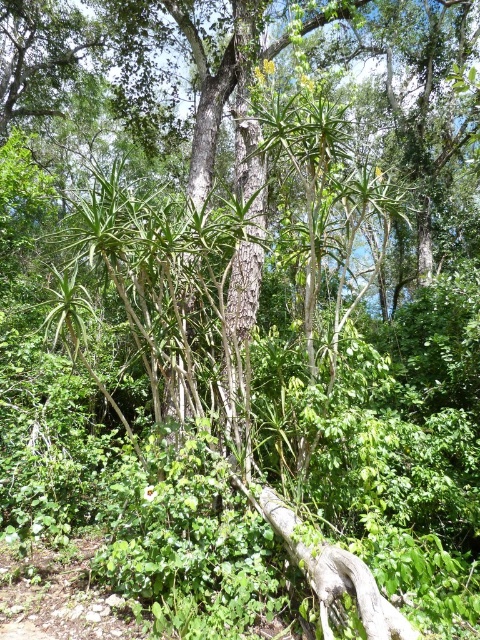
Is smooth bark tree trunk at center in front of gray rough log at center?

No, smooth bark tree trunk at center is further to the viewer.

Between point (261, 1) and point (385, 627), which one is positioned in front?

Point (385, 627)

Is point (230, 358) closer to viewer compared to point (275, 497)?

No, (230, 358) is further to viewer.

This screenshot has height=640, width=480. What are the coordinates of `smooth bark tree trunk at center` in the screenshot? It's located at (244, 204).